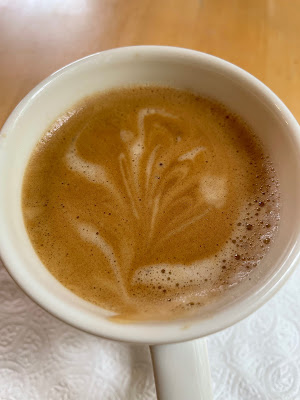
This screenshot has width=300, height=400. In order to click on cup in this screenshot , I will do `click(149, 71)`, `click(81, 78)`, `click(15, 128)`, `click(3, 198)`, `click(21, 251)`, `click(59, 299)`, `click(170, 327)`, `click(275, 271)`, `click(282, 151)`, `click(248, 90)`.